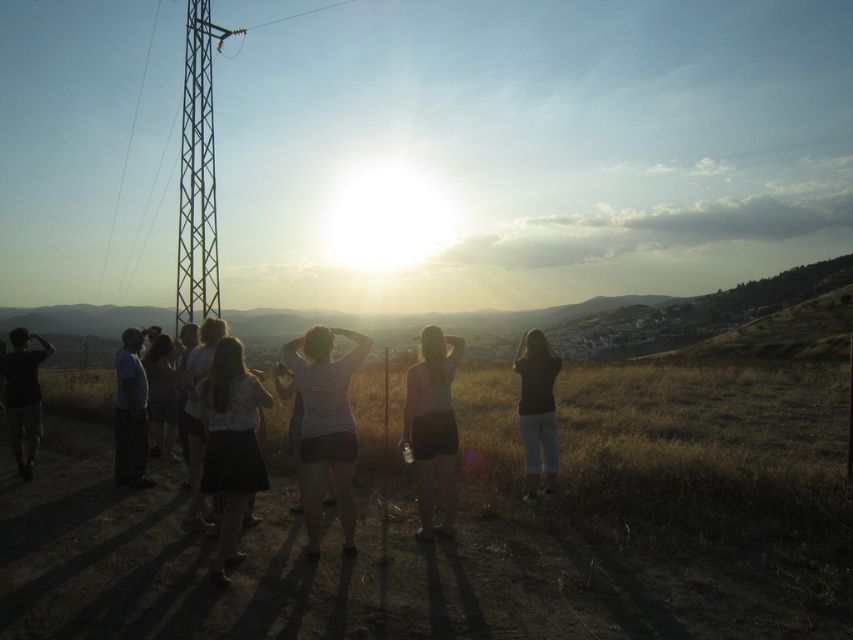
You are a photographer trying to capture a clear shot of the matte white tank top at center and the black matte shirt at left. Since the sun is causing a lens flare, which object might be more affected by the glare and why?

The matte white tank top at center is more affected by the glare because it is in front and white surfaces reflect light more than black ones.

You are a photographer setting up for a sunset shoot. You notice two people in the scene, one wearing a black matte skirt at lower left and another in dark gray pants at left. Which clothing item is positioned more to the right side of the frame?

The black matte skirt at lower left is positioned more to the right side of the frame compared to the dark gray pants at left.